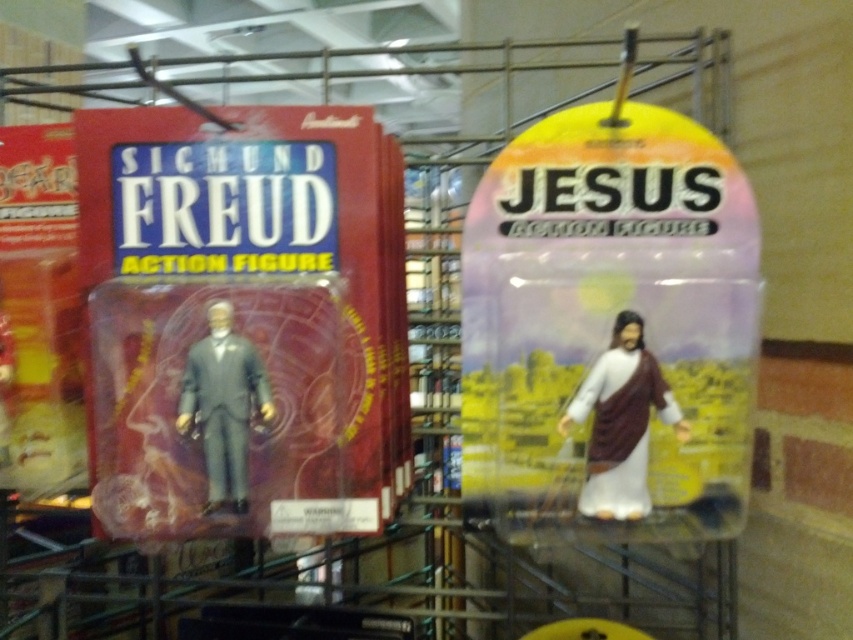
You are an interior designer arranging a shelf. You have two items to place side by side. The first is the white matte jesus action figure at right and the second is the matte gray suit at left. If you want to maintain the original arrangement shown in the image, which item should be placed on the left side of the shelf?

To maintain the original arrangement, the matte gray suit at left should be placed on the left side of the shelf since the white matte jesus action figure at right is positioned to its right in the image.

From the picture: You are a collector who wants to place a new 30 cm wide action figure between the white matte jesus action figure at right and the matte gray suit at left on the shelf. Can you fit it without moving the existing figures?

The distance between the white matte jesus action figure at right and the matte gray suit at left is 33.13 centimeters. Since the new action figure is 30 cm wide, there is enough space to fit it between them without moving the existing figures.